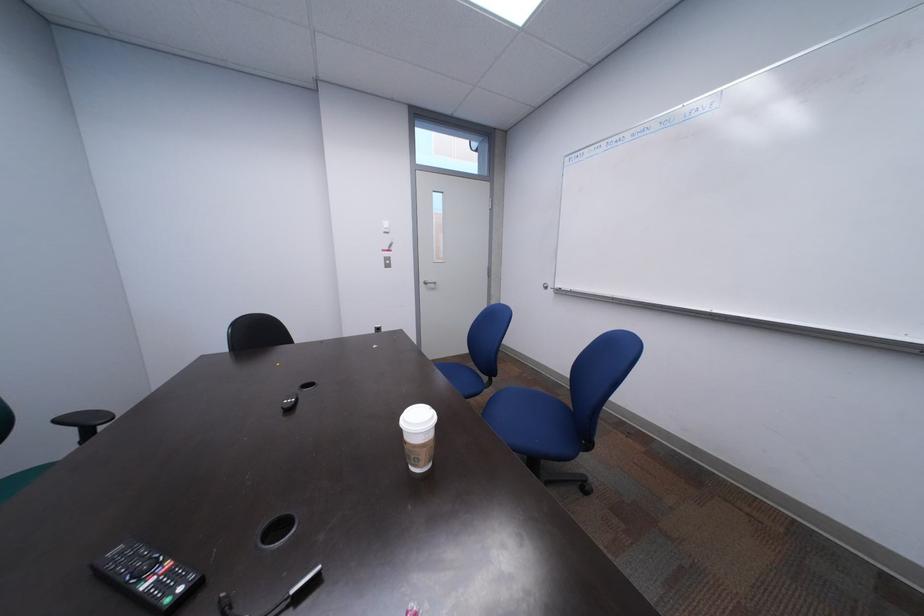
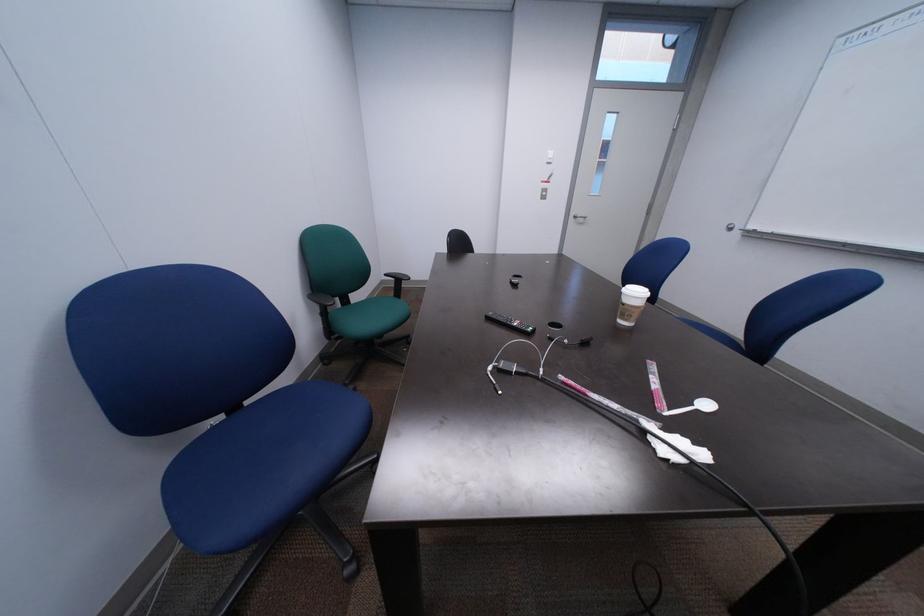
The images are taken continuously from a first-person perspective. In which direction are you moving?

The cameraman walked toward left, backward.